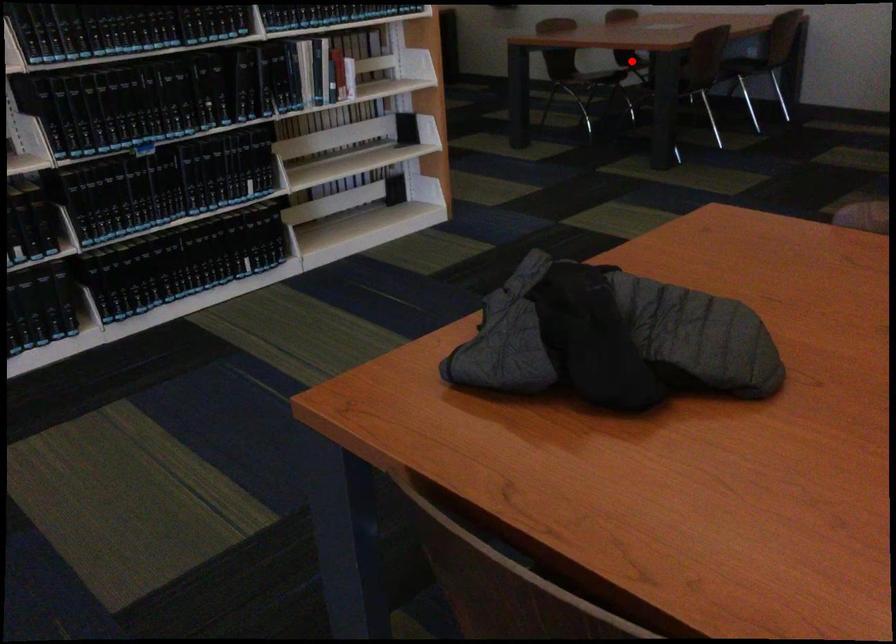
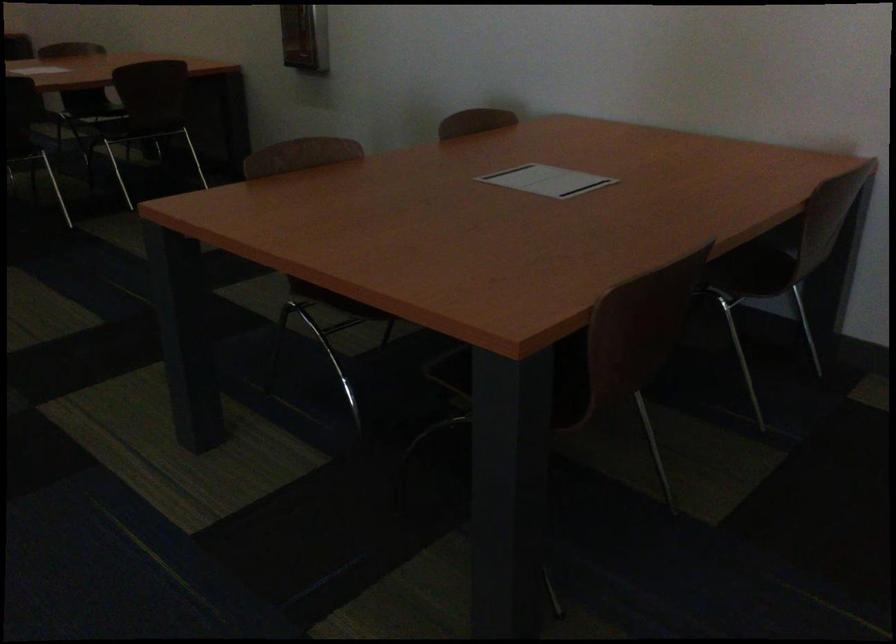
Question: I am providing you with two images of the same scene from different viewpoints. A red point is marked on the first image. Can you still see the location of the red point in image 2?

Choices:
 (A) Yes
 (B) No

Answer: (B)